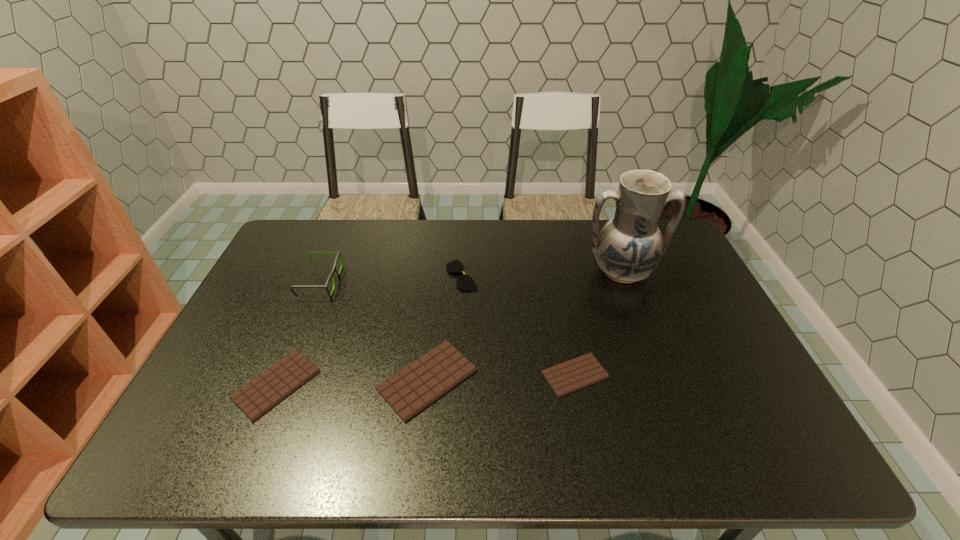
Please point a spot on the right to add another chocolate bar. Please provide its 2D coordinates. Your answer should be formatted as a tuple, i.e. [(x, y)], where the tuple contains the x and y coordinates of a point satisfying the conditions above.

[(720, 370)]